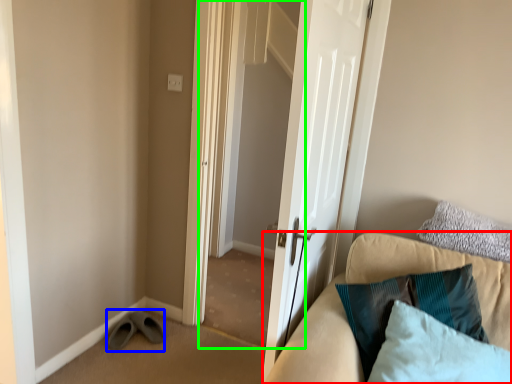
Question: Based on their relative distances, which object is nearer to studio couch (highlighted by a red box)? Choose from shoe (highlighted by a blue box) and screen door (highlighted by a green box).

Choices:
 (A) shoe
 (B) screen door

Answer: (A)